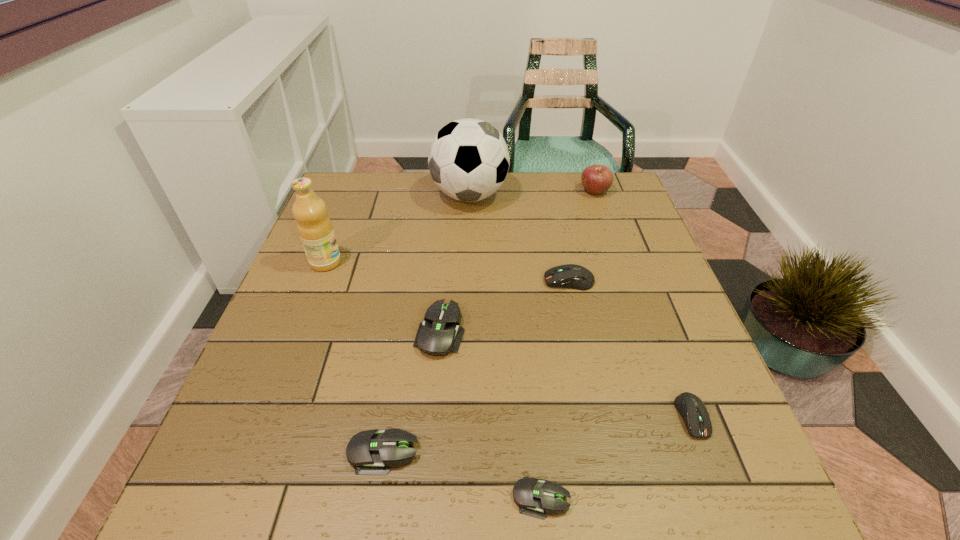
The width and height of the screenshot is (960, 540). Find the location of `the nearest computer mouse`. the nearest computer mouse is located at coordinates (535, 497).

You are a GUI agent. You are given a task and a screenshot of the screen. Output one action in this format:
    pyautogui.click(x=<x>, y=<y>)
    Task: Click on the shortest object
    The width and height of the screenshot is (960, 540).
    Given the screenshot: What is the action you would take?
    pyautogui.click(x=535, y=497)

In order to click on blank space located on the main logo of the black soccer ball in this screenshot , I will do `click(597, 195)`.

This screenshot has height=540, width=960. In order to click on free space located on the label of the olive oil in this screenshot , I will do `click(401, 262)`.

Locate an element on the screen. The height and width of the screenshot is (540, 960). vacant space located 0.190m on the side of the third tallest object with the unique marking is located at coordinates (517, 192).

Image resolution: width=960 pixels, height=540 pixels. In order to click on free location located on the side of the third tallest object with the unique marking in this screenshot , I will do `click(497, 192)`.

Where is `blank space located 0.220m on the side of the third tallest object with the unique marking`? Image resolution: width=960 pixels, height=540 pixels. blank space located 0.220m on the side of the third tallest object with the unique marking is located at coordinates (507, 192).

This screenshot has width=960, height=540. What are the coordinates of `vacant region located on the button of the bigger dark computer equipment` in the screenshot? It's located at (402, 281).

The height and width of the screenshot is (540, 960). In order to click on vacant region located 0.370m on the button of the bigger dark computer equipment in this screenshot , I will do (x=390, y=281).

Where is `vacant space located 0.260m on the button of the bigger dark computer equipment`? The width and height of the screenshot is (960, 540). vacant space located 0.260m on the button of the bigger dark computer equipment is located at coordinates (436, 281).